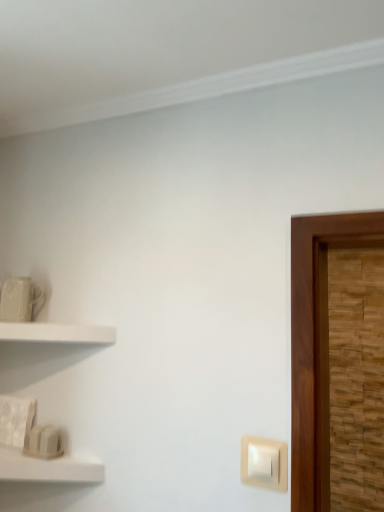
Describe the element at coordinates (269, 464) in the screenshot. The image size is (384, 512). I see `beige plastic light switch at lower right` at that location.

Where is `white matte shelf at left, which is the second shelf in bottom-to-top order`? white matte shelf at left, which is the second shelf in bottom-to-top order is located at coordinates (57, 333).

Where is `white matte shelf at lower left, the 2th shelf in the top-to-bottom sequence`? The image size is (384, 512). white matte shelf at lower left, the 2th shelf in the top-to-bottom sequence is located at coordinates (49, 467).

Is white matte shelf at lower left, the 2th shelf in the top-to-bottom sequence, oriented away from white matte shelf at left, which appears as the first shelf when viewed from the top?

No.

Is white matte shelf at lower left, which ranks as the 1th shelf in bottom-to-top order, directly adjacent to white matte shelf at left, which is the second shelf in bottom-to-top order?

No, white matte shelf at lower left, which ranks as the 1th shelf in bottom-to-top order, is not with white matte shelf at left, which is the second shelf in bottom-to-top order.

Is white matte shelf at lower left, the 2th shelf in the top-to-bottom sequence, thinner than white matte shelf at left, which is the second shelf in bottom-to-top order?

No, white matte shelf at lower left, the 2th shelf in the top-to-bottom sequence, is not thinner than white matte shelf at left, which is the second shelf in bottom-to-top order.

Is beige plastic light switch at lower right spatially inside white matte shelf at left, which appears as the first shelf when viewed from the top, or outside of it?

beige plastic light switch at lower right is not enclosed by white matte shelf at left, which appears as the first shelf when viewed from the top.

Is beige plastic light switch at lower right touching white matte shelf at left, which is the second shelf in bottom-to-top order?

beige plastic light switch at lower right is not next to white matte shelf at left, which is the second shelf in bottom-to-top order, and they're not touching.

The height and width of the screenshot is (512, 384). Find the location of `light switch below the white matte shelf at left, which is the second shelf in bottom-to-top order (from a real-world perspective)`. light switch below the white matte shelf at left, which is the second shelf in bottom-to-top order (from a real-world perspective) is located at coordinates (269, 464).

From the picture: Considering the positions of objects beige plastic light switch at lower right and white matte shelf at left, which is the second shelf in bottom-to-top order, in the image provided, who is more to the left, beige plastic light switch at lower right or white matte shelf at left, which is the second shelf in bottom-to-top order,?

white matte shelf at left, which is the second shelf in bottom-to-top order.

Is point (0, 332) less distant than point (284, 452)?

That is False.

Which object is thinner, white matte shelf at left, which appears as the first shelf when viewed from the top, or beige plastic light switch at lower right?

Thinner between the two is beige plastic light switch at lower right.

Could you tell me if white matte shelf at left, which is the second shelf in bottom-to-top order, is turned towards beige plastic light switch at lower right?

No, white matte shelf at left, which is the second shelf in bottom-to-top order, is not facing towards beige plastic light switch at lower right.

Considering the sizes of white matte shelf at left, which appears as the first shelf when viewed from the top, and beige plastic light switch at lower right in the image, is white matte shelf at left, which appears as the first shelf when viewed from the top, taller or shorter than beige plastic light switch at lower right?

In the image, white matte shelf at left, which appears as the first shelf when viewed from the top, appears to be shorter than beige plastic light switch at lower right.

Is beige plastic light switch at lower right bigger or smaller than white matte shelf at lower left, the 2th shelf in the top-to-bottom sequence?

Clearly, beige plastic light switch at lower right is smaller in size than white matte shelf at lower left, the 2th shelf in the top-to-bottom sequence.

From the image's perspective, which one is positioned higher, beige plastic light switch at lower right or white matte shelf at lower left, the 2th shelf in the top-to-bottom sequence?

beige plastic light switch at lower right is shown above in the image.

Based on the photo, which object is closer to the camera taking this photo, beige plastic light switch at lower right or white matte shelf at lower left, which ranks as the 1th shelf in bottom-to-top order?

white matte shelf at lower left, which ranks as the 1th shelf in bottom-to-top order.

Between white matte shelf at left, which is the second shelf in bottom-to-top order, and white matte shelf at lower left, which ranks as the 1th shelf in bottom-to-top order, which one appears on the left side from the viewer's perspective?

white matte shelf at lower left, which ranks as the 1th shelf in bottom-to-top order, is more to the left.

From a real-world perspective, is white matte shelf at left, which appears as the first shelf when viewed from the top, physically located above or below white matte shelf at lower left, which ranks as the 1th shelf in bottom-to-top order?

From a real-world perspective, white matte shelf at left, which appears as the first shelf when viewed from the top, is physically above white matte shelf at lower left, which ranks as the 1th shelf in bottom-to-top order.

Between white matte shelf at left, which appears as the first shelf when viewed from the top, and white matte shelf at lower left, the 2th shelf in the top-to-bottom sequence, which one has larger width?

With larger width is white matte shelf at lower left, the 2th shelf in the top-to-bottom sequence.

Which is in front, point (67, 329) or point (57, 459)?

Positioned in front is point (57, 459).

Considering the relative sizes of white matte shelf at lower left, the 2th shelf in the top-to-bottom sequence, and beige plastic light switch at lower right in the image provided, is white matte shelf at lower left, the 2th shelf in the top-to-bottom sequence, smaller than beige plastic light switch at lower right?

Actually, white matte shelf at lower left, the 2th shelf in the top-to-bottom sequence, might be larger than beige plastic light switch at lower right.

Is white matte shelf at lower left, the 2th shelf in the top-to-bottom sequence, at the left side of beige plastic light switch at lower right?

Yes.

Where is `shelf located behind the white matte shelf at lower left, the 2th shelf in the top-to-bottom sequence`? This screenshot has height=512, width=384. shelf located behind the white matte shelf at lower left, the 2th shelf in the top-to-bottom sequence is located at coordinates (57, 333).

The image size is (384, 512). Find the location of `shelf that is the 1st one when counting leftward from the beige plastic light switch at lower right`. shelf that is the 1st one when counting leftward from the beige plastic light switch at lower right is located at coordinates (57, 333).

Based on their spatial positions, is white matte shelf at left, which appears as the first shelf when viewed from the top, or beige plastic light switch at lower right closer to white matte shelf at lower left, which ranks as the 1th shelf in bottom-to-top order?

white matte shelf at left, which appears as the first shelf when viewed from the top, lies closer to white matte shelf at lower left, which ranks as the 1th shelf in bottom-to-top order, than the other object.

Based on their spatial positions, is white matte shelf at lower left, which ranks as the 1th shelf in bottom-to-top order, or beige plastic light switch at lower right further from white matte shelf at left, which appears as the first shelf when viewed from the top?

Among the two, beige plastic light switch at lower right is located further to white matte shelf at left, which appears as the first shelf when viewed from the top.

Based on their spatial positions, is white matte shelf at left, which appears as the first shelf when viewed from the top, or white matte shelf at lower left, which ranks as the 1th shelf in bottom-to-top order, further from beige plastic light switch at lower right?

white matte shelf at left, which appears as the first shelf when viewed from the top, is positioned further to the anchor beige plastic light switch at lower right.

Based on their spatial positions, is beige plastic light switch at lower right or white matte shelf at left, which appears as the first shelf when viewed from the top, further from white matte shelf at lower left, which ranks as the 1th shelf in bottom-to-top order?

beige plastic light switch at lower right is further to white matte shelf at lower left, which ranks as the 1th shelf in bottom-to-top order.

Based on their spatial positions, is white matte shelf at lower left, the 2th shelf in the top-to-bottom sequence, or white matte shelf at left, which appears as the first shelf when viewed from the top, further from beige plastic light switch at lower right?

white matte shelf at left, which appears as the first shelf when viewed from the top, is further to beige plastic light switch at lower right.

When comparing their distances from white matte shelf at left, which appears as the first shelf when viewed from the top, does beige plastic light switch at lower right or white matte shelf at lower left, the 2th shelf in the top-to-bottom sequence, seem further?

beige plastic light switch at lower right is positioned further to the anchor white matte shelf at left, which appears as the first shelf when viewed from the top.

Where is `shelf located between white matte shelf at lower left, which ranks as the 1th shelf in bottom-to-top order, and beige plastic light switch at lower right in the left-right direction`? Image resolution: width=384 pixels, height=512 pixels. shelf located between white matte shelf at lower left, which ranks as the 1th shelf in bottom-to-top order, and beige plastic light switch at lower right in the left-right direction is located at coordinates (57, 333).